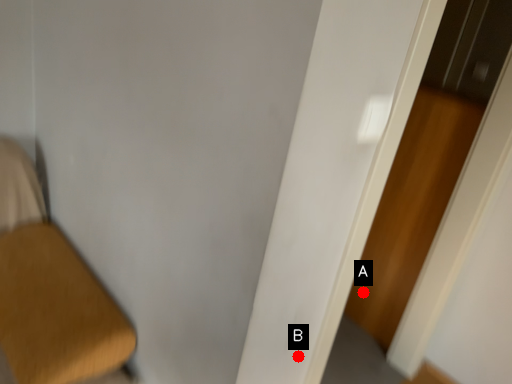
Question: Two points are circled on the image, labeled by A and B beside each circle. Among these points, which one is nearest to the camera?

Choices:
 (A) A is closer
 (B) B is closer

Answer: (B)